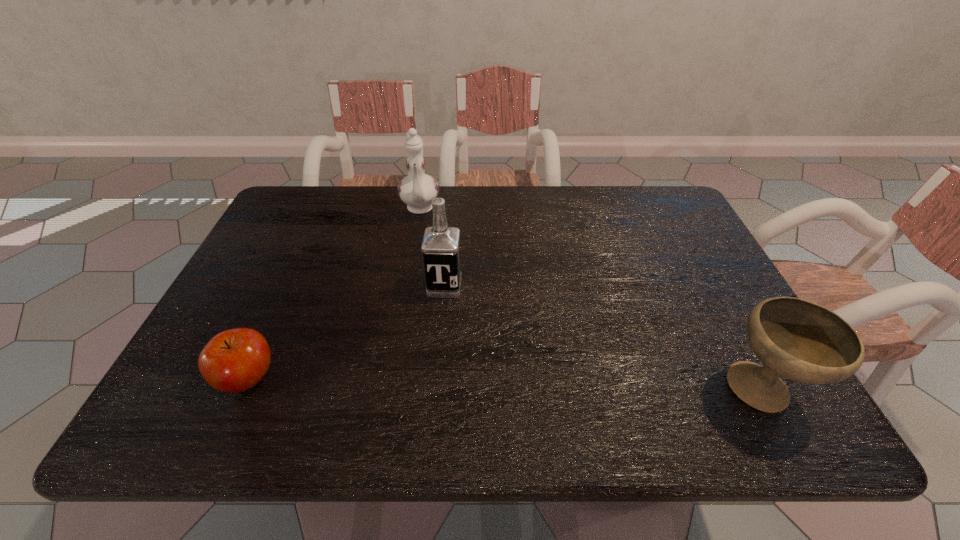
Find the location of a particular element. The width and height of the screenshot is (960, 540). the leftmost object is located at coordinates (235, 360).

This screenshot has height=540, width=960. I want to click on apple, so [235, 360].

This screenshot has height=540, width=960. What are the coordinates of `the rightmost object` in the screenshot? It's located at (797, 339).

I want to click on chalice, so click(x=797, y=339).

This screenshot has width=960, height=540. Identify the location of chinaware. (417, 190).

Where is `vodka`? The image size is (960, 540). vodka is located at coordinates (441, 251).

Find the location of a particular element. This screenshot has width=960, height=540. vacant space located on the left of the apple is located at coordinates (188, 380).

Find the location of a particular element. The height and width of the screenshot is (540, 960). free space located 0.290m on the back of the chalice is located at coordinates (695, 266).

The width and height of the screenshot is (960, 540). I want to click on free space located 0.360m at the spout of the chinaware, so click(x=422, y=315).

Where is `vacant space located at the spout of the chinaware`? This screenshot has height=540, width=960. vacant space located at the spout of the chinaware is located at coordinates (422, 306).